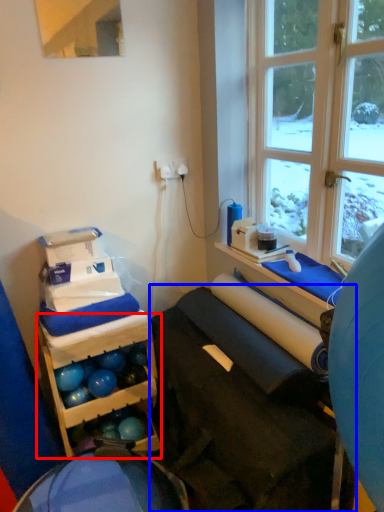
Question: Among these objects, which one is nearest to the camera, shelf (highlighted by a red box) or furniture (highlighted by a blue box)?

Choices:
 (A) shelf
 (B) furniture

Answer: (B)